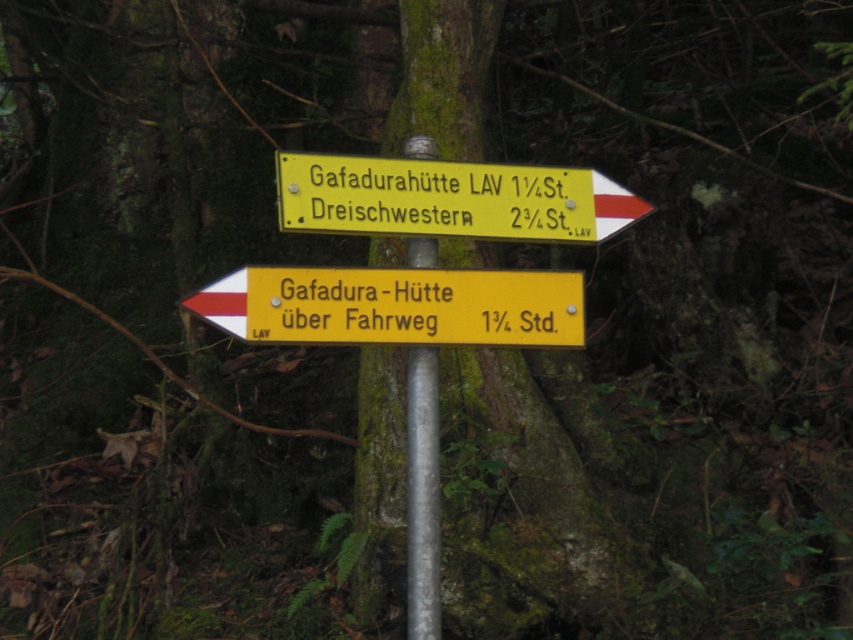
You are standing in front of the two yellow plastic signs in the forest. Which sign is closer to you, the yellow plastic sign at center or the yellow plastic sign at upper center?

The yellow plastic sign at center is closer to you because it is in front of the yellow plastic sign at upper center.

You are standing at the point marked by the coordinates in the image. Which of the two points, point (488, 298) or point (442, 163), is closer to you?

Point (488, 298) is in front of point (442, 163), so it is closer to you.